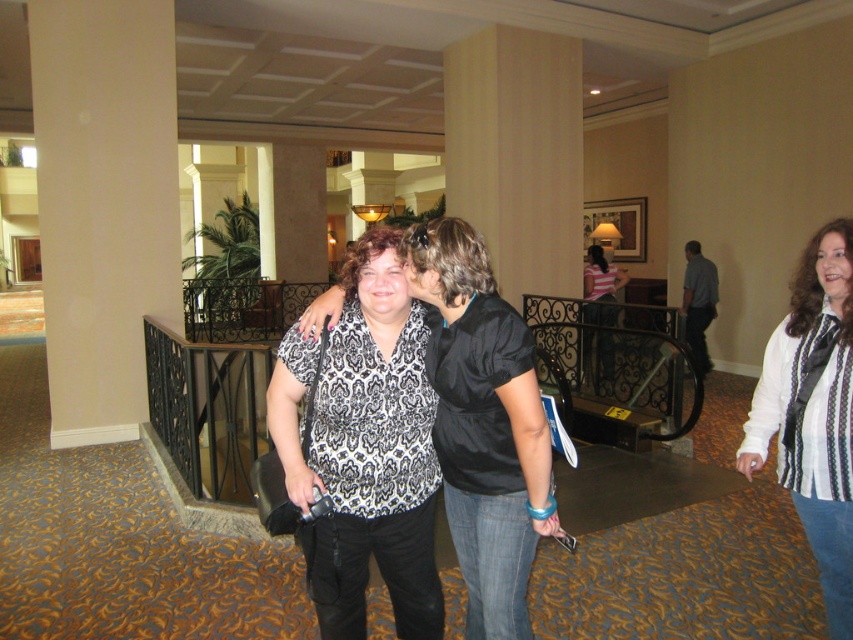
Question: Is black printed blouse at center positioned in front of black and white patterned blouse at center?

Choices:
 (A) no
 (B) yes

Answer: (A)

Question: Which is nearer to the black and white patterned blouse at center?

Choices:
 (A) white striped shirt at center
 (B) black printed blouse at center

Answer: (B)

Question: Which point is farther to the camera?

Choices:
 (A) black and white patterned blouse at center
 (B) white striped shirt at center
 (C) black printed blouse at center

Answer: (B)

Question: Which object is the closest to the black printed blouse at center?

Choices:
 (A) black and white patterned blouse at center
 (B) white striped shirt at center

Answer: (A)

Question: Is black printed blouse at center thinner than black and white patterned blouse at center?

Choices:
 (A) no
 (B) yes

Answer: (A)

Question: Can you confirm if black printed blouse at center is bigger than white striped shirt at center?

Choices:
 (A) no
 (B) yes

Answer: (B)